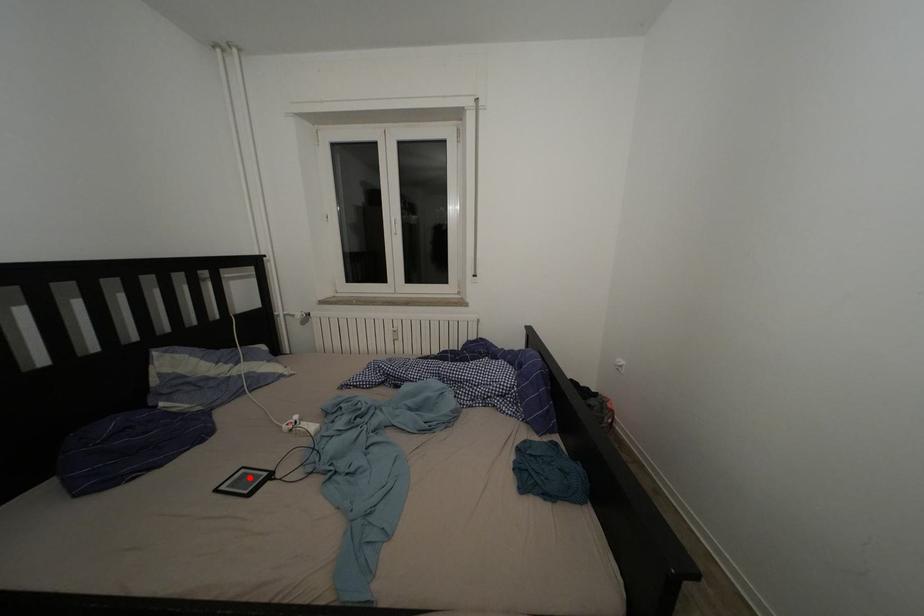
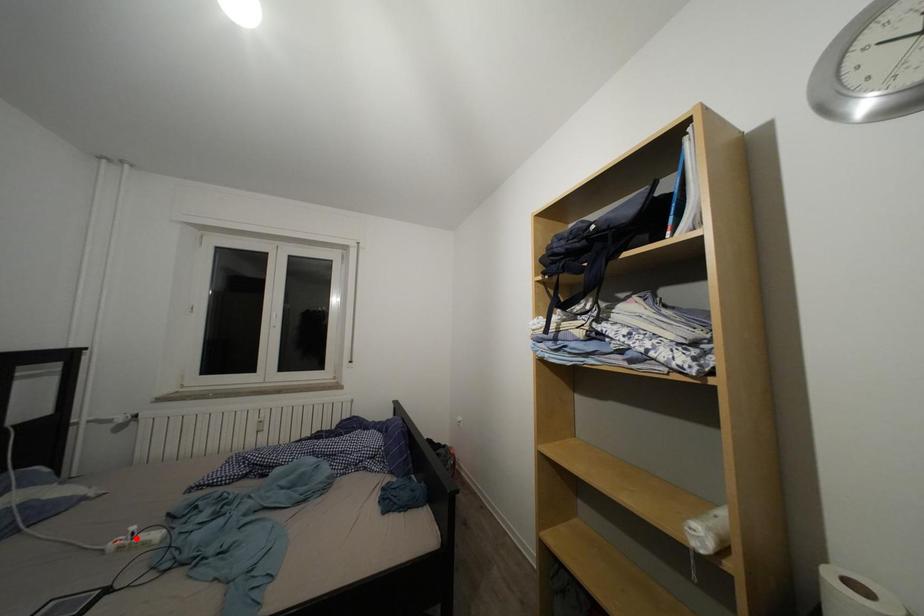
I am providing you with two images of the same scene from different viewpoints. A red point is marked on the first image and another point is marked on the second image. Are the points marked in image1 and image2 representing the same 3D position?

No